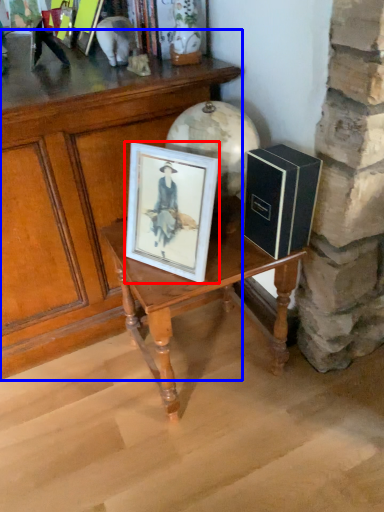
Question: Which object appears farthest to the camera in this image, picture frame (highlighted by a red box) or table (highlighted by a blue box)?

Choices:
 (A) picture frame
 (B) table

Answer: (B)